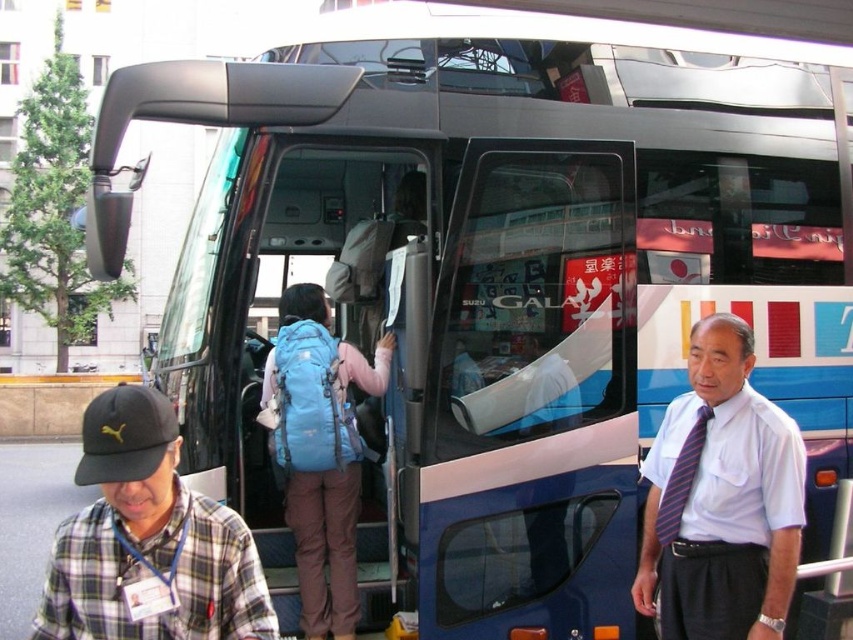
Who is shorter, blue fabric backpack at center or striped fabric tie at right?

striped fabric tie at right is shorter.

Which is above, blue fabric backpack at center or striped fabric tie at right?

blue fabric backpack at center is higher up.

Describe the element at coordinates (325, 547) in the screenshot. I see `blue fabric backpack at center` at that location.

Find the location of a particular element. Image resolution: width=853 pixels, height=640 pixels. blue fabric backpack at center is located at coordinates (325, 547).

Can you confirm if white shirt with tie at center is taller than blue fabric backpack at center?

Indeed, white shirt with tie at center has a greater height compared to blue fabric backpack at center.

Does white shirt with tie at center appear on the right side of blue fabric backpack at center?

Yes, white shirt with tie at center is to the right of blue fabric backpack at center.

Is point (693, 506) positioned after point (347, 573)?

No, (693, 506) is closer to viewer.

The image size is (853, 640). Identify the location of white shirt with tie at center. (721, 499).

Who is positioned more to the left, plaid shirt at lower left or blue fabric backpack at center?

Positioned to the left is plaid shirt at lower left.

Can you confirm if plaid shirt at lower left is wider than blue fabric backpack at center?

Correct, the width of plaid shirt at lower left exceeds that of blue fabric backpack at center.

Locate an element on the screen. plaid shirt at lower left is located at coordinates (148, 540).